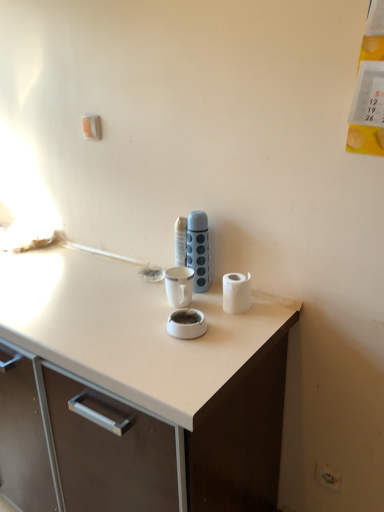
What are the coordinates of `white matte paper towel at right` in the screenshot? It's located at (236, 293).

Where is `white plastic electric outlet at lower right`? Image resolution: width=384 pixels, height=512 pixels. white plastic electric outlet at lower right is located at coordinates (329, 476).

Is white plastic electric outlet at lower right a part of blue textured thermos at center?

No, blue textured thermos at center does not contain white plastic electric outlet at lower right.

Is blue textured thermos at center at the left side of white plastic electric outlet at lower right?

Yes.

Relative to white plastic electric outlet at lower right, is blue textured thermos at center in front or behind?

In the image, blue textured thermos at center appears in front of white plastic electric outlet at lower right.

Is point (190, 233) behind point (336, 478)?

No, it is not.

Which of these two, white plastic electric outlet at lower right or blue textured thermos at center, is bigger?

Bigger between the two is blue textured thermos at center.

From the image's perspective, which one is positioned lower, white plastic electric outlet at lower right or blue textured thermos at center?

white plastic electric outlet at lower right, from the image's perspective.

Measure the distance between white plastic electric outlet at lower right and blue textured thermos at center.

They are 29.71 inches apart.

Can you tell me how much white plastic electric outlet at lower right and blue textured thermos at center differ in facing direction?

The angular difference between white plastic electric outlet at lower right and blue textured thermos at center is 0.672 degrees.

Does white matte paper towel at right have a larger size compared to blue textured thermos at center?

No.

In the scene shown: Could you tell me if white matte paper towel at right is facing blue textured thermos at center?

No, white matte paper towel at right is not oriented towards blue textured thermos at center.

Is white matte paper towel at right at the left side of blue textured thermos at center?

Incorrect, white matte paper towel at right is not on the left side of blue textured thermos at center.

Can you confirm if blue textured thermos at center is smaller than white matte paper towel at right?

Incorrect, blue textured thermos at center is not smaller in size than white matte paper towel at right.

Considering the relative sizes of blue textured thermos at center and white matte paper towel at right in the image provided, is blue textured thermos at center shorter than white matte paper towel at right?

No, blue textured thermos at center is not shorter than white matte paper towel at right.

Which object is positioned more to the left, blue textured thermos at center or white matte paper towel at right?

Positioned to the left is blue textured thermos at center.

Which is closer, (191, 220) or (240, 276)?

Point (191, 220) is farther from the camera than point (240, 276).

Looking at this image, is white matte paper towel at right positioned with its back to white plastic electric outlet at lower right?

No, white matte paper towel at right's orientation is not away from white plastic electric outlet at lower right.

Does white matte paper towel at right have a lesser width compared to white plastic electric outlet at lower right?

No.

Is white matte paper towel at right in contact with white plastic electric outlet at lower right?

No, white matte paper towel at right is not with white plastic electric outlet at lower right.

From the image's perspective, which one is positioned higher, white matte paper towel at right or white plastic electric outlet at lower right?

From the image's view, white matte paper towel at right is above.

Which is less distant, [335,483] or [242,302]?

Point [335,483] is positioned farther from the camera compared to point [242,302].

This screenshot has height=512, width=384. Find the location of `electric outlet below the white matte paper towel at right (from a real-world perspective)`. electric outlet below the white matte paper towel at right (from a real-world perspective) is located at coordinates (329, 476).

Is white plastic electric outlet at lower right not inside white matte paper towel at right?

That's correct, white plastic electric outlet at lower right is outside of white matte paper towel at right.

From the image's perspective, between white plastic electric outlet at lower right and white matte paper towel at right, who is located below?

white plastic electric outlet at lower right.

Find the location of a particular element. The image size is (384, 512). electric outlet behind the blue textured thermos at center is located at coordinates (329, 476).

This screenshot has height=512, width=384. Find the location of `electric outlet directly beneath the blue textured thermos at center (from a real-world perspective)`. electric outlet directly beneath the blue textured thermos at center (from a real-world perspective) is located at coordinates (329, 476).

Based on their spatial positions, is white plastic electric outlet at lower right or blue textured thermos at center further from white matte paper towel at right?

white plastic electric outlet at lower right lies further to white matte paper towel at right than the other object.

Estimate the real-world distances between objects in this image. Which object is further from white matte paper towel at right, blue textured thermos at center or white plastic electric outlet at lower right?

white plastic electric outlet at lower right is further to white matte paper towel at right.

Estimate the real-world distances between objects in this image. Which object is further from white plastic electric outlet at lower right, blue textured thermos at center or white matte paper towel at right?

blue textured thermos at center lies further to white plastic electric outlet at lower right than the other object.

Looking at the image, which one is located further to white plastic electric outlet at lower right, white matte paper towel at right or blue textured thermos at center?

Based on the image, blue textured thermos at center appears to be further to white plastic electric outlet at lower right.

From the picture: Which object lies further to the anchor point blue textured thermos at center, white matte paper towel at right or white plastic electric outlet at lower right?

Among the two, white plastic electric outlet at lower right is located further to blue textured thermos at center.

When comparing their distances from blue textured thermos at center, does white plastic electric outlet at lower right or white matte paper towel at right seem closer?

white matte paper towel at right lies closer to blue textured thermos at center than the other object.

The height and width of the screenshot is (512, 384). I want to click on paper towel between blue textured thermos at center and white plastic electric outlet at lower right in the up-down direction, so click(x=236, y=293).